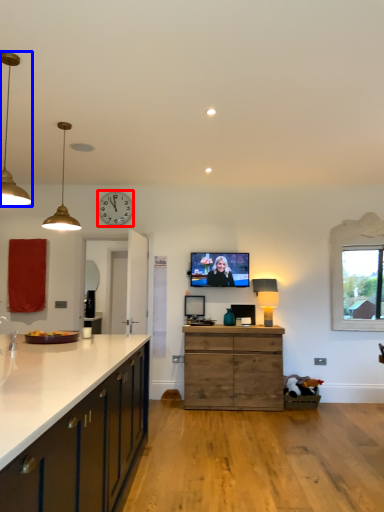
Question: Which object appears closest to the camera in this image, clock (highlighted by a red box) or lamp (highlighted by a blue box)?

Choices:
 (A) clock
 (B) lamp

Answer: (B)